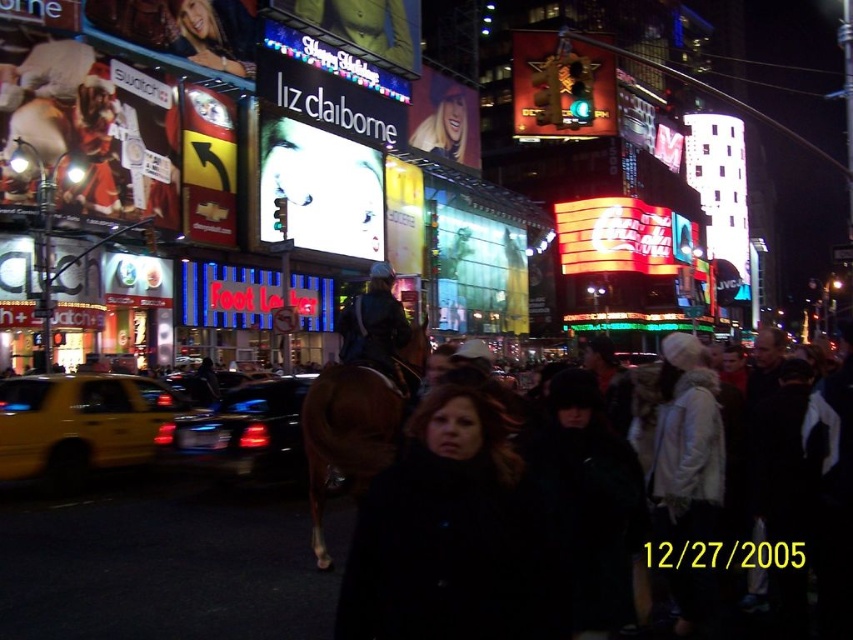
Question: Is metallic silver billboard at center thinner than neon plastic coca-cola sign at center?

Choices:
 (A) no
 (B) yes

Answer: (B)

Question: Which point is farther to the camera?

Choices:
 (A) (566, 97)
 (B) (439, 484)
 (C) (386, 301)

Answer: (A)

Question: Is black wool coat at center positioned at the back of smooth plastic woman at upper center?

Choices:
 (A) no
 (B) yes

Answer: (A)

Question: Estimate the real-world distances between objects in this image. Which object is closer to the dark brown leather jacket at center?

Choices:
 (A) metallic silver billboard at center
 (B) matte black jacket at upper left
 (C) yellow matte taxi at left

Answer: (C)

Question: Observing the image, what is the correct spatial positioning of shiny black car at center in reference to smooth plastic woman at upper center?

Choices:
 (A) above
 (B) below

Answer: (B)

Question: Estimate the real-world distances between objects in this image. Which object is farther from the metallic silver billboard at center?

Choices:
 (A) yellow matte taxi at left
 (B) dark wool coat at center
 (C) metallic gold statue at upper center
 (D) metallic chevrolet sign at upper left

Answer: (B)